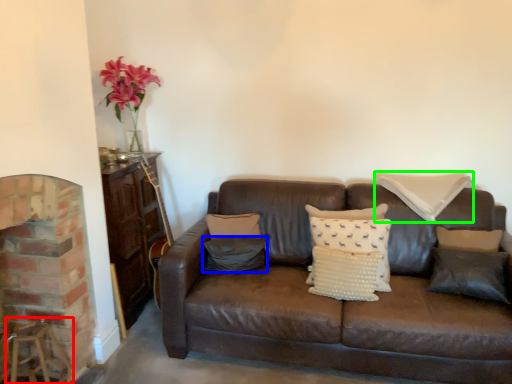
Question: Based on their relative distances, which object is farther from bar stool (highlighted by a red box)? Choose from pillow (highlighted by a blue box) and pillow (highlighted by a green box).

Choices:
 (A) pillow
 (B) pillow

Answer: (B)